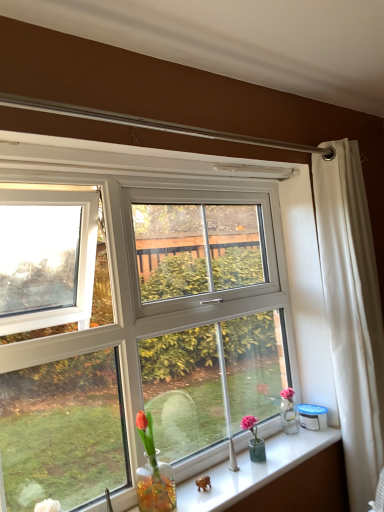
The width and height of the screenshot is (384, 512). Identify the location of empty space that is ontop of clear glass vase at lower center. (252, 465).